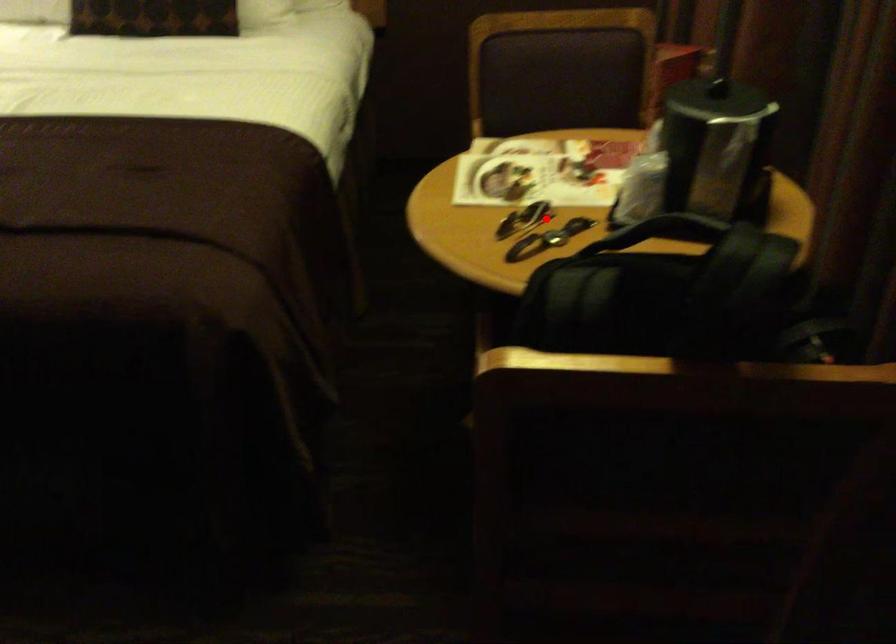
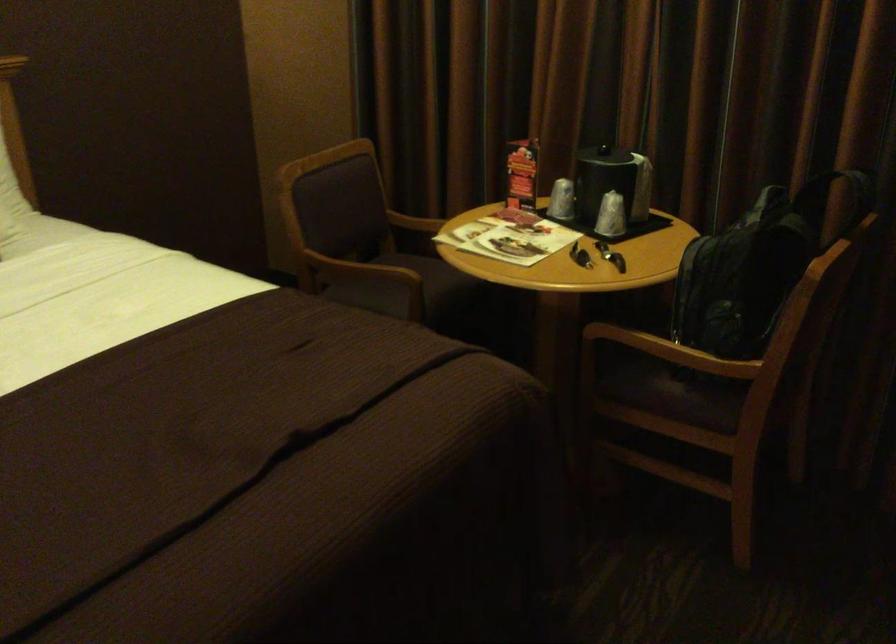
Question: I am providing you with two images of the same scene from different viewpoints. A red point is shown in image1. For the corresponding object point in image2, is it positioned nearer or farther from the camera?

Choices:
 (A) Nearer
 (B) Farther

Answer: (B)